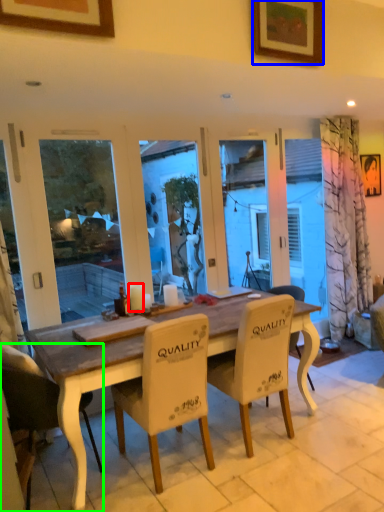
Question: Which object is positioned farthest from candle (highlighted by a red box)? Select from picture frame (highlighted by a blue box) and chair (highlighted by a green box).

Choices:
 (A) picture frame
 (B) chair

Answer: (A)